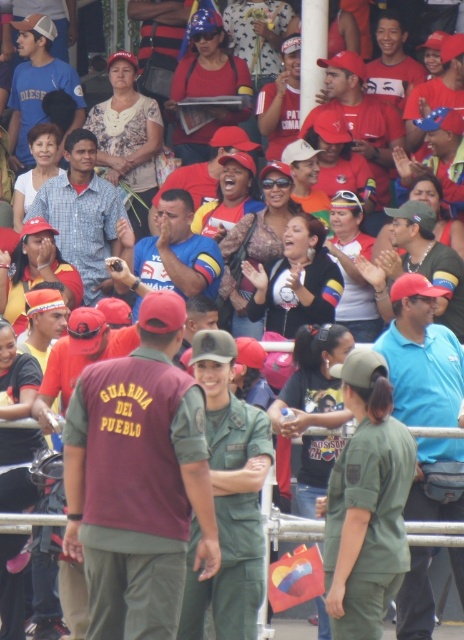
Question: Which of the following is the farthest from the observer?

Choices:
 (A) blue fabric shirt at center
 (B) maroon uniform at center
 (C) matte black cap at center
 (D) blue cotton shirt at center

Answer: (C)

Question: Is matte blue shirt at center bigger than blue fabric shirt at center?

Choices:
 (A) no
 (B) yes

Answer: (B)

Question: Is blue cotton shirt at center smaller than blue fabric shirt at center?

Choices:
 (A) no
 (B) yes

Answer: (B)

Question: Can you confirm if blue cotton shirt at center is smaller than blue fabric shirt at center?

Choices:
 (A) yes
 (B) no

Answer: (A)

Question: Among these objects, which one is nearest to the camera?

Choices:
 (A) matte black cap at center
 (B) matte red cap at center
 (C) maroon uniform at center
 (D) blue fabric shirt at center

Answer: (C)

Question: Which point is farther to the camera?

Choices:
 (A) maroon uniform at center
 (B) blue cotton shirt at center
 (C) blue fabric shirt at center
 (D) matte black cap at center

Answer: (D)